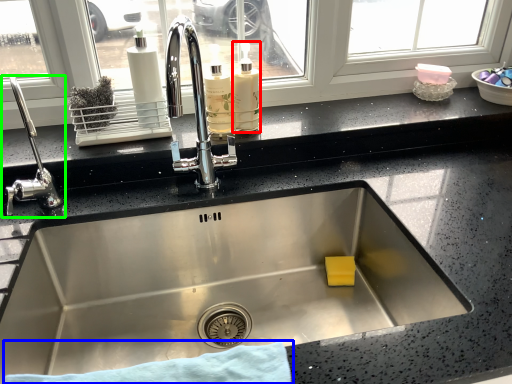
Question: Estimate the real-world distances between objects in this image. Which object is farther from bottle (highlighted by a red box), bath towel (highlighted by a blue box) or tap (highlighted by a green box)?

Choices:
 (A) bath towel
 (B) tap

Answer: (A)